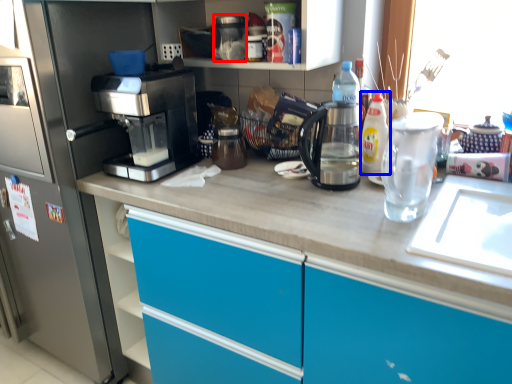
Question: Which point is further to the camera, appliance (highlighted by a red box) or bottle (highlighted by a blue box)?

Choices:
 (A) appliance
 (B) bottle

Answer: (A)